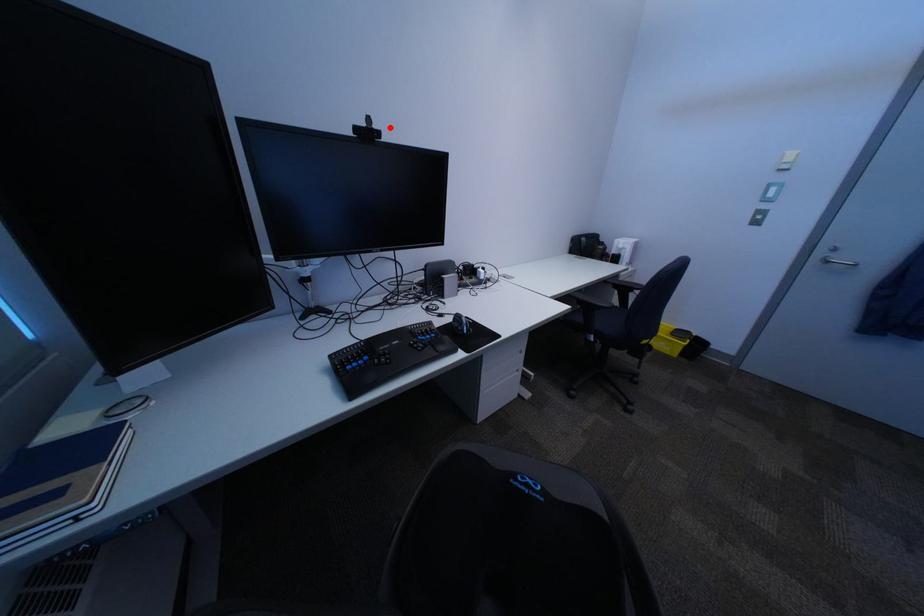
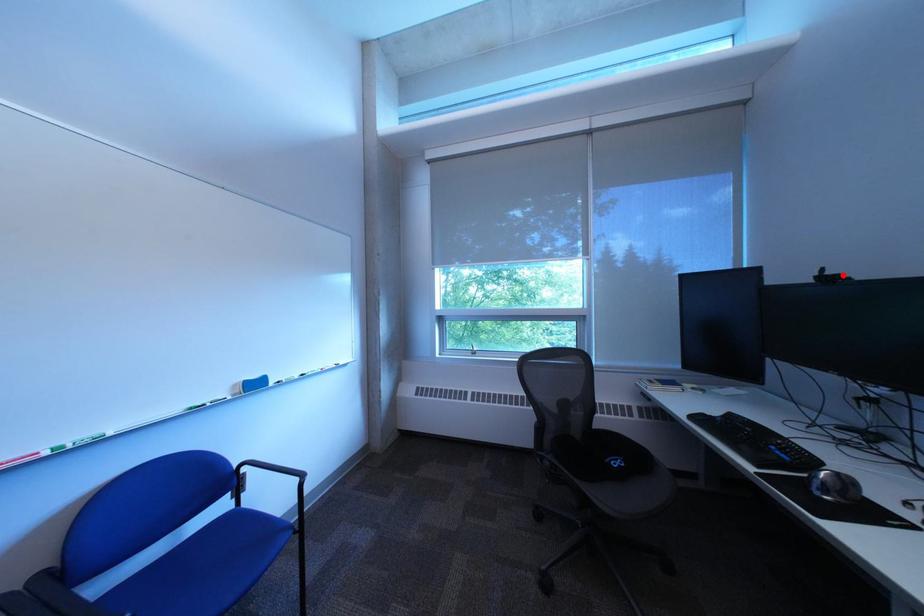
I am providing you with two images of the same scene from different viewpoints. A red point is marked on the first image and another point is marked on the second image. Does the point marked in image1 correspond to the same location as the one in image2?

Yes